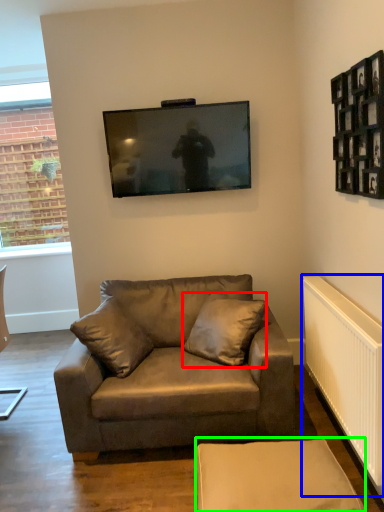
Question: Estimate the real-world distances between objects in this image. Which object is farther from pillow (highlighted by a red box), radiator (highlighted by a blue box) or swivel chair (highlighted by a green box)?

Choices:
 (A) radiator
 (B) swivel chair

Answer: (B)